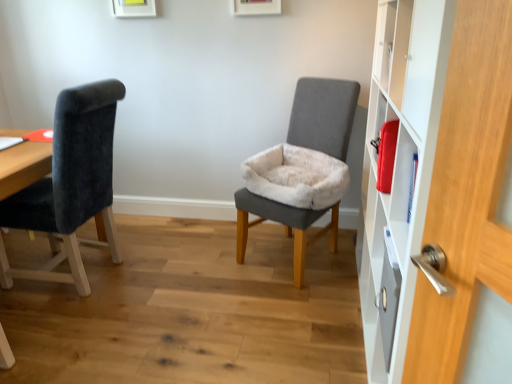
I want to click on free spot below velvet black chair at left, marked as the first chair in a left-to-right arrangement (from a real-world perspective), so click(106, 273).